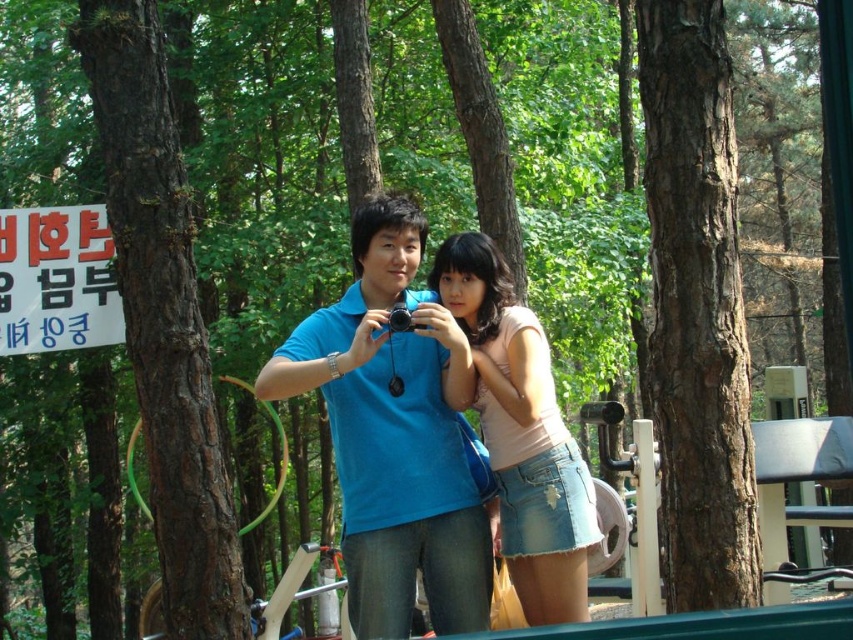
Question: Which of the following is the farthest from the observer?

Choices:
 (A) brown rough bark tree at center
 (B) pink denim skirt at center

Answer: (A)

Question: Can you confirm if blue cotton shirt at center is positioned to the right of brown rough bark tree at left?

Choices:
 (A) no
 (B) yes

Answer: (B)

Question: Does blue cotton shirt at center appear on the left side of pink denim skirt at center?

Choices:
 (A) yes
 (B) no

Answer: (A)

Question: Is brown rough bark tree at center below pink denim skirt at center?

Choices:
 (A) yes
 (B) no

Answer: (B)

Question: Based on their relative distances, which object is nearer to the brown rough bark tree at left?

Choices:
 (A) pink denim skirt at center
 (B) brown rough bark tree at center

Answer: (A)

Question: Considering the real-world distances, which object is closest to the blue cotton shirt at center?

Choices:
 (A) brown rough bark tree at center
 (B) pink denim skirt at center
 (C) brown rough bark tree at left

Answer: (B)